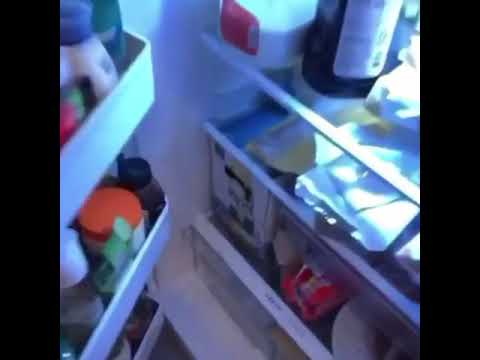
The width and height of the screenshot is (480, 360). I want to click on bottle, so click(x=136, y=323).